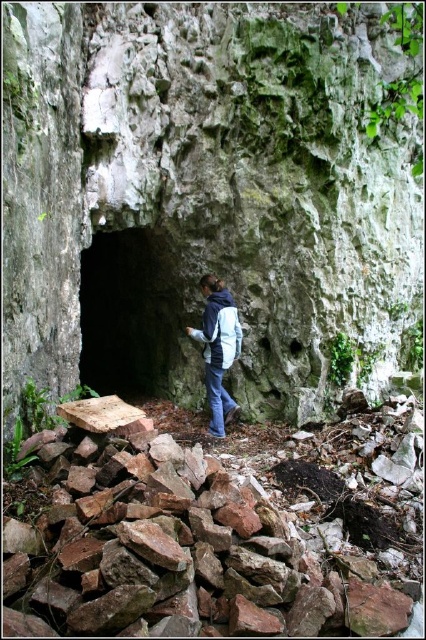
You are a geologist exploring the area and need to collect samples from both the green mossy rock at center and the dark stone cave at center. If your sample collection kit has a maximum reach of 1 meter, can you collect both samples without moving closer?

The green mossy rock at center is 1.09 meters from the dark stone cave at center. Since the distance between them is greater than 1 meter, the sample collection kit cannot reach both samples simultaneously without moving closer.

You are a geologist examining the rock formation. You need to locate the green mossy rock at center. Where exactly is it positioned in the image?

The green mossy rock at center is located at point (x=204, y=196).

You are an explorer standing at the entrance of the cave. You see the green mossy rock at center and the rusty stone rubble at lower center. Which object is closer to you?

The green mossy rock at center is closer to you since the rusty stone rubble at lower center is behind it.